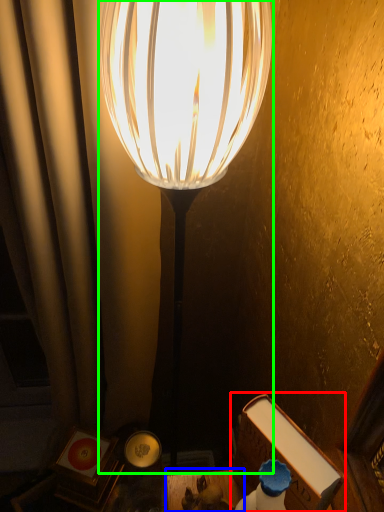
Question: Which object is the farthest from book (highlighted by a red box)? Choose among these: table (highlighted by a blue box) or lamp (highlighted by a green box).

Choices:
 (A) table
 (B) lamp

Answer: (B)